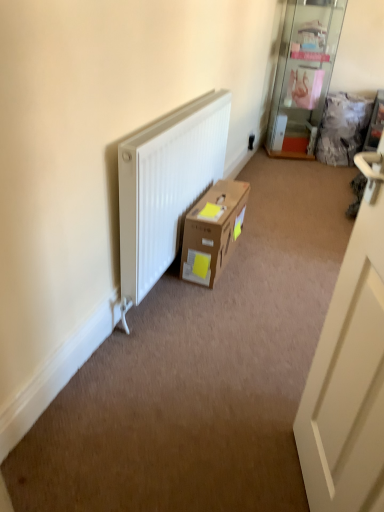
At what (x,y) coordinates should I click in order to perform the action: click on vacant space that's between white matte door at right and brown cardboard box at center. Please return your answer as a coordinate pair (x, y). Image resolution: width=384 pixels, height=512 pixels. Looking at the image, I should click on pyautogui.click(x=245, y=333).